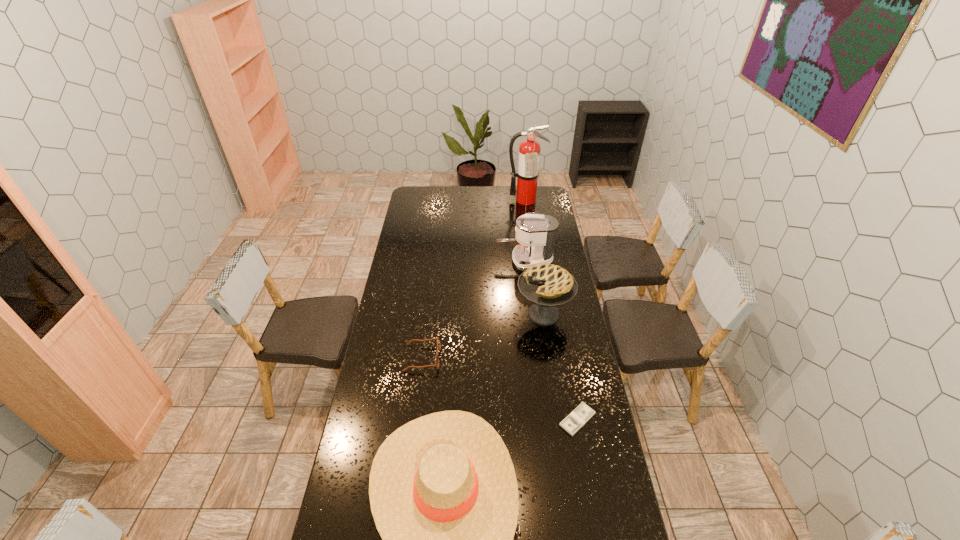
Find the location of a particular element. pie that is at the right edge is located at coordinates (547, 286).

Image resolution: width=960 pixels, height=540 pixels. I want to click on dollar that is positioned at the right edge, so click(582, 414).

You are a GUI agent. You are given a task and a screenshot of the screen. Output one action in this format:
    pyautogui.click(x=<x>, y=<y>)
    Task: Click on the object present at the far right corner
    This screenshot has height=540, width=960.
    Given the screenshot: What is the action you would take?
    pyautogui.click(x=527, y=174)

In order to click on vacant space at the far edge of the desktop in this screenshot , I will do `click(512, 199)`.

I want to click on vacant space at the left edge of the desktop, so click(418, 296).

In the image, there is a desktop. At what (x,y) coordinates should I click in order to perform the action: click on vacant space at the right edge. Please return your answer as a coordinate pair (x, y). The height and width of the screenshot is (540, 960). Looking at the image, I should click on (565, 409).

The width and height of the screenshot is (960, 540). In the image, there is a desktop. What are the coordinates of `vacant space at the far left corner` in the screenshot? It's located at (428, 203).

Find the location of a particular element. The height and width of the screenshot is (540, 960). free spot at the far right corner of the desktop is located at coordinates (541, 192).

Where is `free spot between the pie and the third nearest object`? The width and height of the screenshot is (960, 540). free spot between the pie and the third nearest object is located at coordinates (483, 336).

Identify the location of free space between the coffee maker and the fourth farthest object. (473, 309).